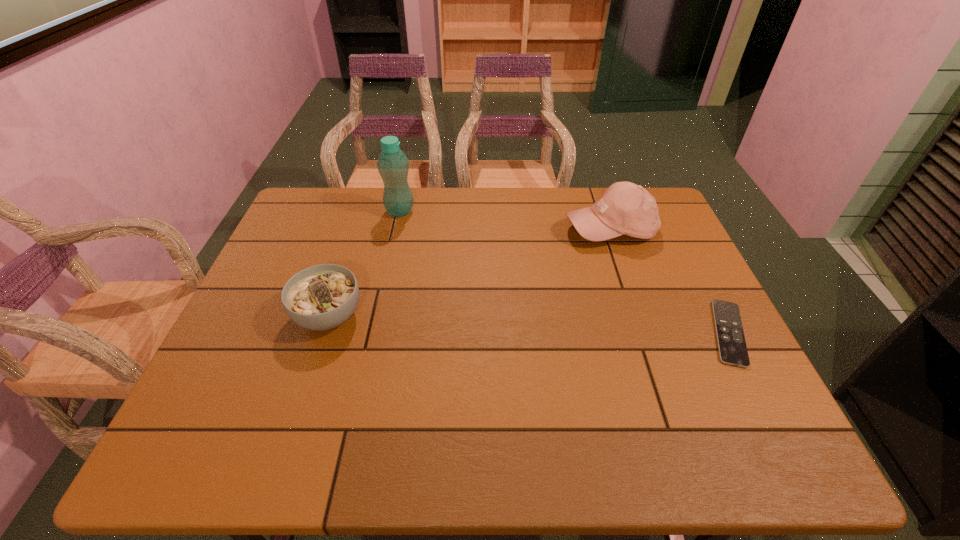
Image resolution: width=960 pixels, height=540 pixels. I want to click on free space at the far edge of the desktop, so click(x=579, y=192).

This screenshot has width=960, height=540. In the image, there is a desktop. In order to click on vacant region at the near edge in this screenshot , I will do `click(574, 390)`.

Locate an element on the screen. free space at the left edge of the desktop is located at coordinates (306, 234).

Locate an element on the screen. The image size is (960, 540). vacant space at the right edge of the desktop is located at coordinates (651, 289).

At what (x,y) coordinates should I click in order to perform the action: click on vacant area at the far left corner of the desktop. Please return your answer as a coordinate pair (x, y). Image resolution: width=960 pixels, height=540 pixels. Looking at the image, I should click on (317, 188).

Locate an element on the screen. free space at the far right corner of the desktop is located at coordinates (649, 193).

Where is `blank region between the shortest object and the third tallest object`? blank region between the shortest object and the third tallest object is located at coordinates (529, 325).

Where is `vacant area that lies between the tallest object and the soup bowl`? The width and height of the screenshot is (960, 540). vacant area that lies between the tallest object and the soup bowl is located at coordinates (365, 264).

Find the location of a particular element. blank region between the third shortest object and the third tallest object is located at coordinates (469, 272).

The height and width of the screenshot is (540, 960). I want to click on free space between the water bottle and the third object from left to right, so click(505, 220).